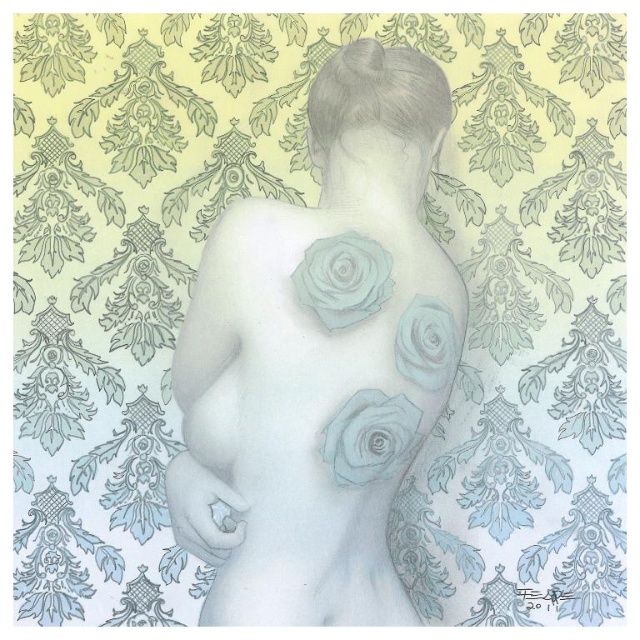
Does light blue pastel rose at upper center appear under matte blue rose at upper right?

No, light blue pastel rose at upper center is not below matte blue rose at upper right.

Does light blue pastel rose at upper center appear on the right side of matte blue rose at upper right?

Incorrect, light blue pastel rose at upper center is not on the right side of matte blue rose at upper right.

The width and height of the screenshot is (640, 640). I want to click on light blue pastel rose at upper center, so click(x=342, y=280).

This screenshot has height=640, width=640. What are the coordinates of `light blue pastel rose at upper center` in the screenshot? It's located at (342, 280).

Is point (324, 440) behind point (417, 296)?

No, (324, 440) is closer to viewer.

Measure the distance from matte gray rose at center to matte blue rose at upper right.

matte gray rose at center is 2.83 inches away from matte blue rose at upper right.

The width and height of the screenshot is (640, 640). What do you see at coordinates (369, 436) in the screenshot?
I see `matte gray rose at center` at bounding box center [369, 436].

You are a GUI agent. You are given a task and a screenshot of the screen. Output one action in this format:
    pyautogui.click(x=<x>, y=<y>)
    Task: Click on the matte gray rose at center
    
    Given the screenshot: What is the action you would take?
    pyautogui.click(x=369, y=436)

Is light blue paper rose at center smaller than matte blue rose at upper right?

Actually, light blue paper rose at center might be larger than matte blue rose at upper right.

Describe the element at coordinates (316, 358) in the screenshot. This screenshot has width=640, height=640. I see `light blue paper rose at center` at that location.

Find the location of `light blue paper rose at center`. light blue paper rose at center is located at coordinates (316, 358).